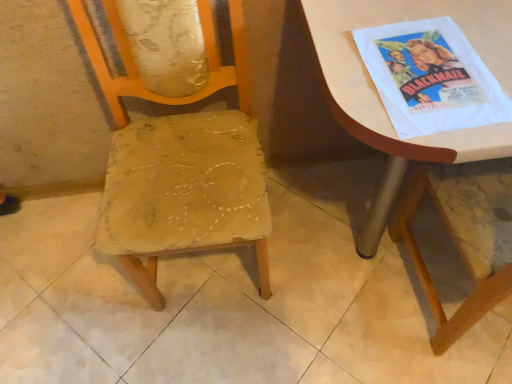
This screenshot has width=512, height=384. I want to click on free space to the left of white paper poster at upper right, so click(348, 81).